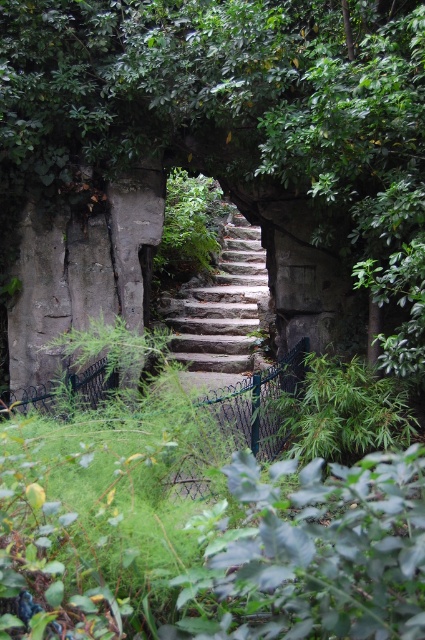
You are planning to walk up the stone stairs at center while carrying a large backpack. Considering the green leafy tree at center, will there be enough space to pass through without touching the tree?

The green leafy tree at center might be wider than the stone stairs at center, so there is a possibility that the tree could obstruct the path. It is advisable to check the actual width before proceeding to avoid contact with the tree.